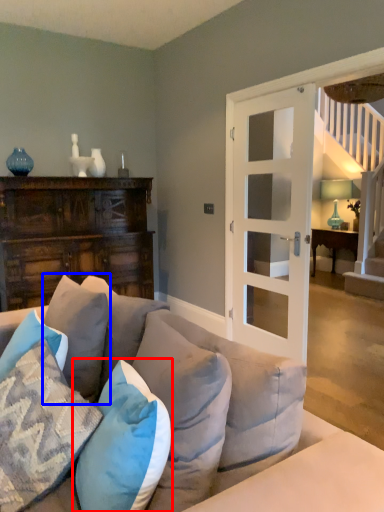
Question: Which object is closer to the camera taking this photo, pillow (highlighted by a red box) or pillow (highlighted by a blue box)?

Choices:
 (A) pillow
 (B) pillow

Answer: (A)